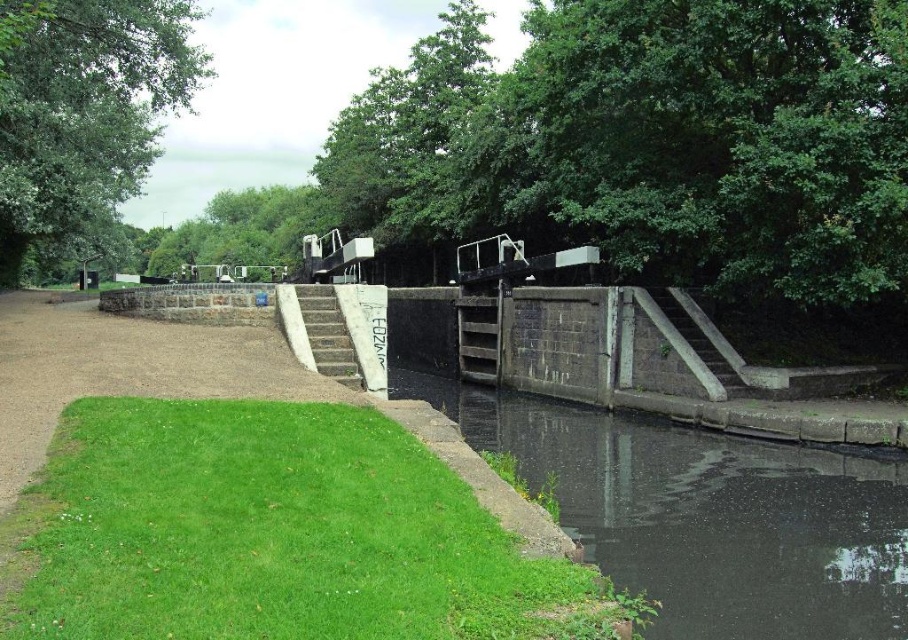
Consider the image. You are a boat operator trying to navigate through the canal lock. You see the dark concrete water at center and the green leafy tree at upper left. Which object is closer to the water surface?

The dark concrete water at center is closer to the water surface since it is the water itself, while the green leafy tree at upper left is taller and positioned above it.

Looking at this image, you are standing at the canal lock and want to reach the green leafy tree at upper left. The path is 38.26 feet long. If you walk at a speed of 3 feet per second, how many seconds will it take you to reach the tree?

The distance between you and the green leafy tree at upper left is 38.26 feet. Walking at 3 feet per second, it would take approximately 12.75 seconds to reach the tree.

You are a boat captain preparing to navigate through the canal lock. You see the dark concrete water at center and the green leafy tree at upper left. Which object is positioned higher in the image?

The green leafy tree at upper left is positioned higher in the image than the dark concrete water at center, as it is located above it.